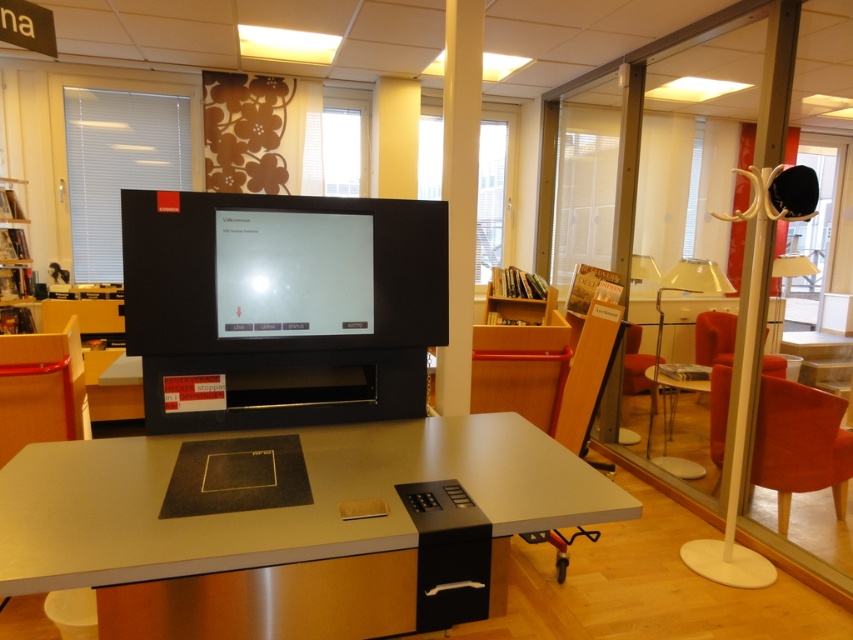
Question: Does matte black computer desk at center appear on the right side of black matte computer monitor at center?

Choices:
 (A) no
 (B) yes

Answer: (B)

Question: Which of the following is the farthest from the observer?

Choices:
 (A) black matte computer monitor at center
 (B) velvet red armchair at right

Answer: (B)

Question: Which of the following is the closest to the observer?

Choices:
 (A) transparent glass door at right
 (B) matte gray table at center

Answer: (A)

Question: Is black matte computer monitor at center closer to the viewer compared to matte gray table at center?

Choices:
 (A) no
 (B) yes

Answer: (B)

Question: Can you confirm if black matte computer monitor at center is positioned to the left of wooden bookshelf at right?

Choices:
 (A) yes
 (B) no

Answer: (A)

Question: Among these objects, which one is farthest from the camera?

Choices:
 (A) wooden bookshelf at right
 (B) velvet red armchair at right
 (C) matte black computer desk at center

Answer: (A)